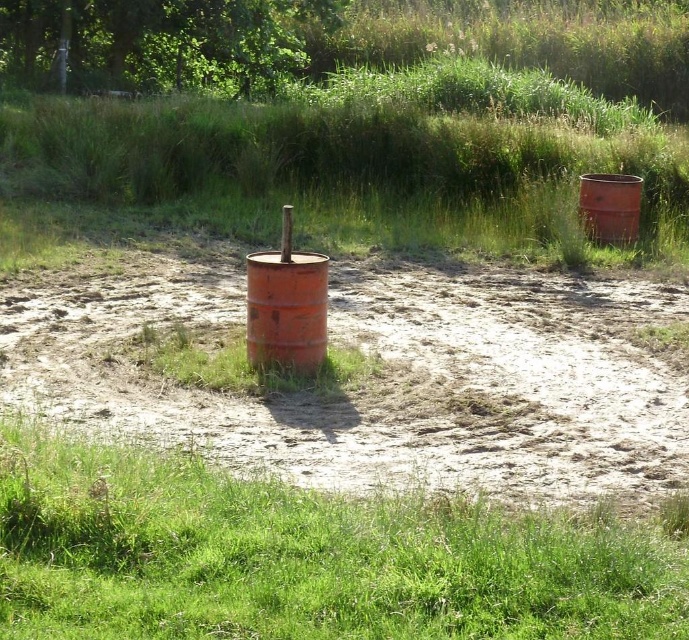
Question: Which point is farther from the camera taking this photo?

Choices:
 (A) (276, 349)
 (B) (41, 317)
 (C) (637, 221)

Answer: (C)

Question: Where is dull orange barrel at center located in relation to green grass at lower center in the image?

Choices:
 (A) below
 (B) above

Answer: (B)

Question: Is rusty metal barrel at center smaller than rusty metal barrel at right?

Choices:
 (A) no
 (B) yes

Answer: (A)

Question: Which object is closer to the camera taking this photo?

Choices:
 (A) rusty metal barrel at right
 (B) rusty metal barrel at center

Answer: (B)

Question: Which of the following is the farthest from the observer?

Choices:
 (A) (575, 547)
 (B) (668, 378)

Answer: (B)

Question: Is dull orange barrel at center further to the viewer compared to rusty metal barrel at right?

Choices:
 (A) no
 (B) yes

Answer: (A)